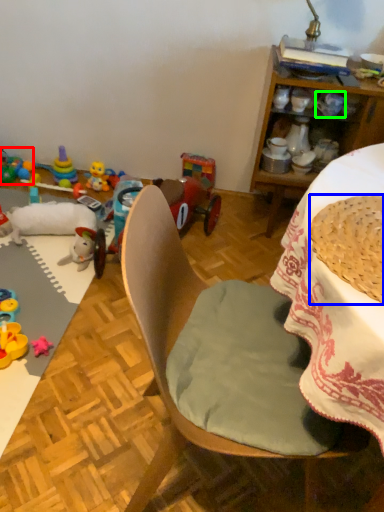
Question: Which object is the farthest from toy (highlighted by a red box)? Choose among these: basket (highlighted by a blue box) or coffee cup (highlighted by a green box).

Choices:
 (A) basket
 (B) coffee cup

Answer: (A)